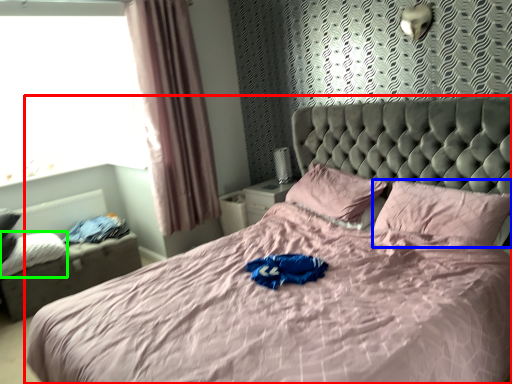
Question: Which object is the closest to the bed (highlighted by a red box)? Choose among these: pillow (highlighted by a blue box) or pillow (highlighted by a green box).

Choices:
 (A) pillow
 (B) pillow

Answer: (A)